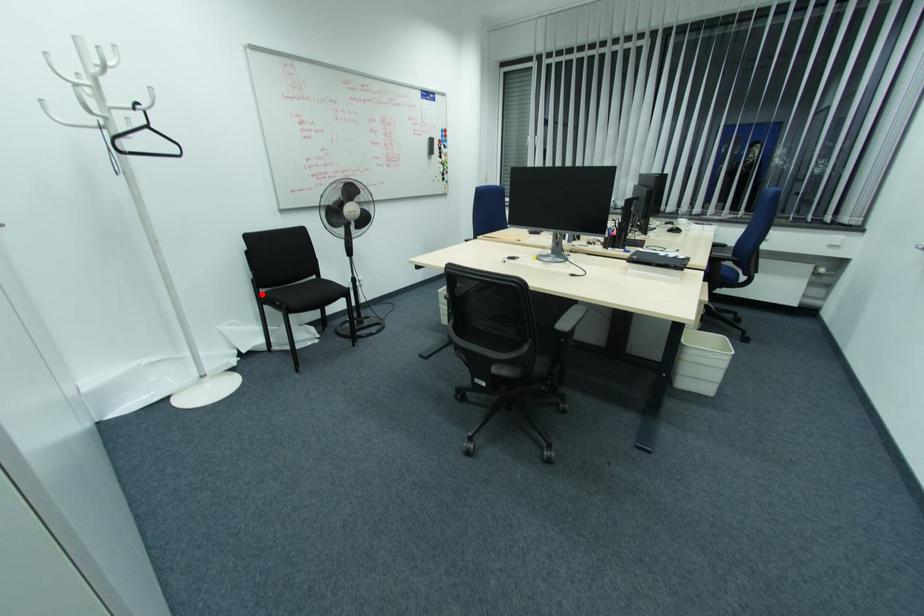
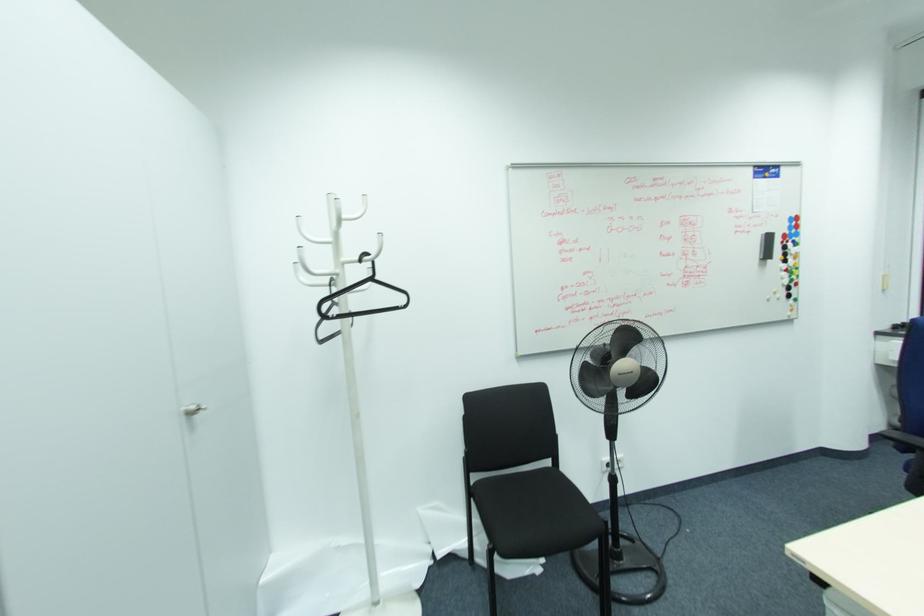
Question: I am providing you with two images of the same scene from different viewpoints. A red point is marked on the first image. Is the red point's position out of view in image 2?

Choices:
 (A) Yes
 (B) No

Answer: (B)